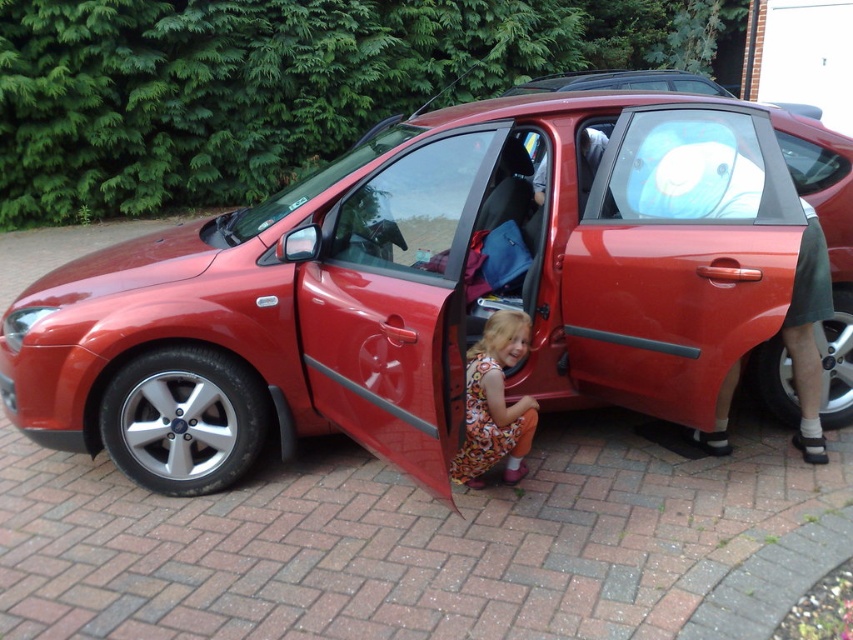
Does glossy red car at center appear on the left side of floral dress at lower center?

Yes, glossy red car at center is to the left of floral dress at lower center.

Does glossy red car at center have a smaller size compared to floral dress at lower center?

Actually, glossy red car at center might be larger than floral dress at lower center.

The image size is (853, 640). Describe the element at coordinates (445, 289) in the screenshot. I see `glossy red car at center` at that location.

The height and width of the screenshot is (640, 853). I want to click on glossy red car at center, so click(x=445, y=289).

Which is above, glossy red car at center or matte red minivan at center?

matte red minivan at center

Is glossy red car at center above matte red minivan at center?

Actually, glossy red car at center is below matte red minivan at center.

Is point (134, 332) positioned behind point (822, 211)?

No, it is not.

The height and width of the screenshot is (640, 853). I want to click on glossy red car at center, so click(445, 289).

Which is below, matte red minivan at center or floral dress at lower center?

floral dress at lower center is lower down.

Between matte red minivan at center and floral dress at lower center, which one appears on the left side from the viewer's perspective?

Positioned to the left is floral dress at lower center.

Locate an element on the screen. matte red minivan at center is located at coordinates (830, 256).

At what (x,y) coordinates should I click in order to perform the action: click on matte red minivan at center. Please return your answer as a coordinate pair (x, y). This screenshot has width=853, height=640. Looking at the image, I should click on (830, 256).